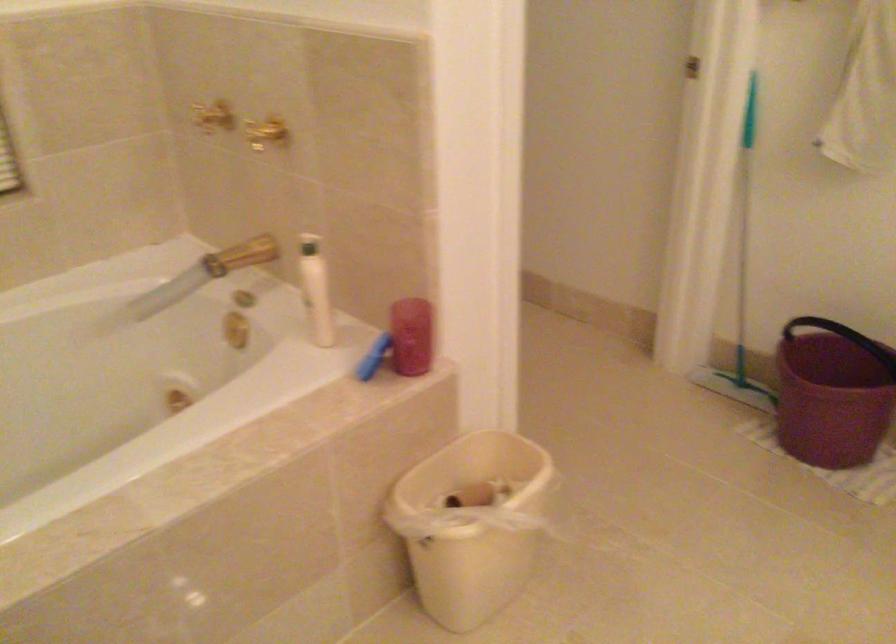
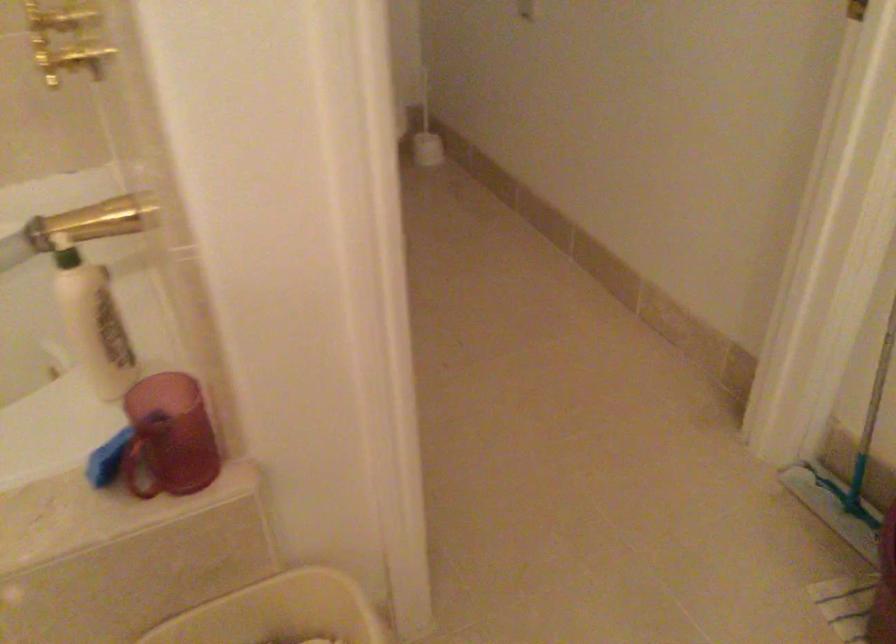
The point at [743,324] is marked in the first image. Where is the corresponding point in the second image?

(866, 431)